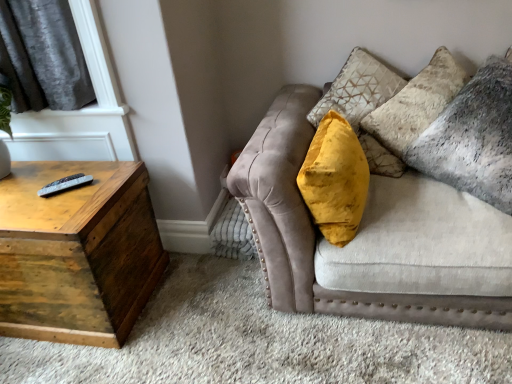
Locate an element on the screen. Image resolution: width=512 pixels, height=384 pixels. blank space situated above wooden trunk at left (from a real-world perspective) is located at coordinates (44, 196).